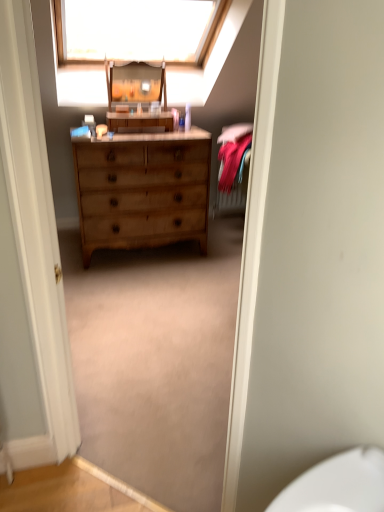
Question: Is wooden dresser at center looking in the opposite direction of white fabric at upper center?

Choices:
 (A) no
 (B) yes

Answer: (A)

Question: Is wooden dresser at center placed right next to white fabric at upper center?

Choices:
 (A) yes
 (B) no

Answer: (B)

Question: From a real-world perspective, is wooden dresser at center physically above white fabric at upper center?

Choices:
 (A) yes
 (B) no

Answer: (B)

Question: Does wooden dresser at center turn towards white fabric at upper center?

Choices:
 (A) yes
 (B) no

Answer: (B)

Question: Considering the relative sizes of wooden dresser at center and white fabric at upper center in the image provided, is wooden dresser at center wider than white fabric at upper center?

Choices:
 (A) no
 (B) yes

Answer: (A)

Question: Is wooden changing table at center wider or thinner than white fabric at upper center?

Choices:
 (A) thin
 (B) wide

Answer: (A)

Question: Considering the positions of wooden changing table at center and white fabric at upper center in the image, is wooden changing table at center taller or shorter than white fabric at upper center?

Choices:
 (A) tall
 (B) short

Answer: (B)

Question: Visually, is wooden changing table at center positioned to the left or to the right of white fabric at upper center?

Choices:
 (A) right
 (B) left

Answer: (B)

Question: From a real-world perspective, is wooden changing table at center positioned above or below white fabric at upper center?

Choices:
 (A) below
 (B) above

Answer: (A)

Question: Considering their positions, is light brown wood dresser at center located in front of or behind white fabric at upper center?

Choices:
 (A) behind
 (B) front

Answer: (A)

Question: Considering the positions of point (205, 168) and point (147, 17), is point (205, 168) closer or farther from the camera than point (147, 17)?

Choices:
 (A) farther
 (B) closer

Answer: (A)

Question: Looking at their shapes, would you say light brown wood dresser at center is wider or thinner than white fabric at upper center?

Choices:
 (A) thin
 (B) wide

Answer: (B)

Question: Considering the positions of light brown wood dresser at center and white fabric at upper center in the image, is light brown wood dresser at center bigger or smaller than white fabric at upper center?

Choices:
 (A) big
 (B) small

Answer: (A)

Question: From the image's perspective, is white fabric at upper center positioned above or below velvet pink bed at right?

Choices:
 (A) above
 (B) below

Answer: (A)

Question: Is white fabric at upper center to the left or to the right of velvet pink bed at right in the image?

Choices:
 (A) right
 (B) left

Answer: (B)